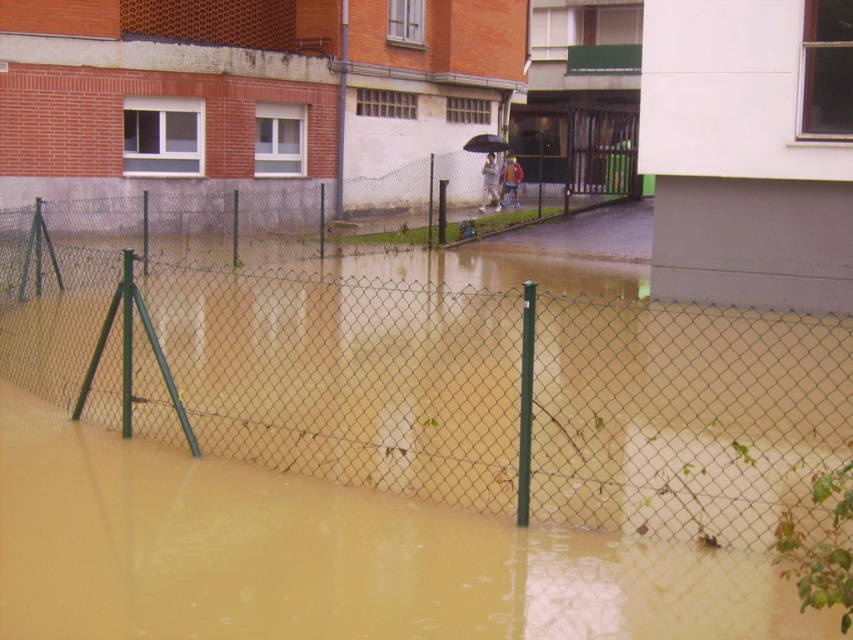
You are a pedestrian trying to cross the flooded area in the image. You see the brown muddy water at lower center and the black matte umbrella at center. Which object is wider from your viewpoint?

The brown muddy water at lower center is wider than the black matte umbrella at center.